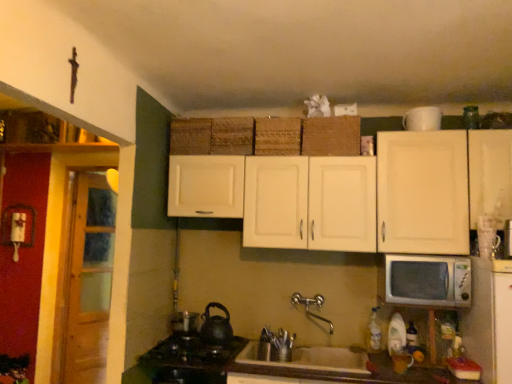
Question: From a real-world perspective, is white plastic microwave at right below woven brown basket at center, acting as the second basket starting from the left?

Choices:
 (A) no
 (B) yes

Answer: (B)

Question: Is white plastic microwave at right wider than woven brown basket at center, the 3th basket when ordered from right to left?

Choices:
 (A) yes
 (B) no

Answer: (A)

Question: Would you say white plastic microwave at right contains woven brown basket at center, the 3th basket when ordered from right to left?

Choices:
 (A) yes
 (B) no

Answer: (B)

Question: Is white plastic microwave at right shorter than woven brown basket at center, acting as the second basket starting from the left?

Choices:
 (A) yes
 (B) no

Answer: (B)

Question: Could you tell me if white plastic microwave at right is facing woven brown basket at center, acting as the second basket starting from the left?

Choices:
 (A) no
 (B) yes

Answer: (A)

Question: From a real-world perspective, is white plastic microwave at right positioned over woven brown basket at center, the 3th basket when ordered from right to left, based on gravity?

Choices:
 (A) yes
 (B) no

Answer: (B)

Question: Considering the relative positions of brown woven basket at upper center, which is counted as the first basket, starting from the right, and white matte sink at lower center in the image provided, is brown woven basket at upper center, which is counted as the first basket, starting from the right, to the right of white matte sink at lower center from the viewer's perspective?

Choices:
 (A) no
 (B) yes

Answer: (A)

Question: Does brown woven basket at upper center, which is counted as the first basket, starting from the right, have a larger size compared to white matte sink at lower center?

Choices:
 (A) yes
 (B) no

Answer: (B)

Question: Is brown woven basket at upper center, which is counted as the first basket, starting from the right, oriented towards white matte sink at lower center?

Choices:
 (A) yes
 (B) no

Answer: (B)

Question: From the image's perspective, is brown woven basket at upper center, which ranks as the 4th basket in left-to-right order, located beneath white matte sink at lower center?

Choices:
 (A) yes
 (B) no

Answer: (B)

Question: Does brown woven basket at upper center, which ranks as the 4th basket in left-to-right order, lie in front of white matte sink at lower center?

Choices:
 (A) no
 (B) yes

Answer: (A)

Question: From a real-world perspective, is brown woven basket at upper center, which ranks as the 4th basket in left-to-right order, under white matte sink at lower center?

Choices:
 (A) no
 (B) yes

Answer: (A)

Question: Is woven brown basket at upper center, which is counted as the first basket, starting from the left, at the back of woven straw basket at center, arranged as the second basket when viewed from the right?

Choices:
 (A) yes
 (B) no

Answer: (B)